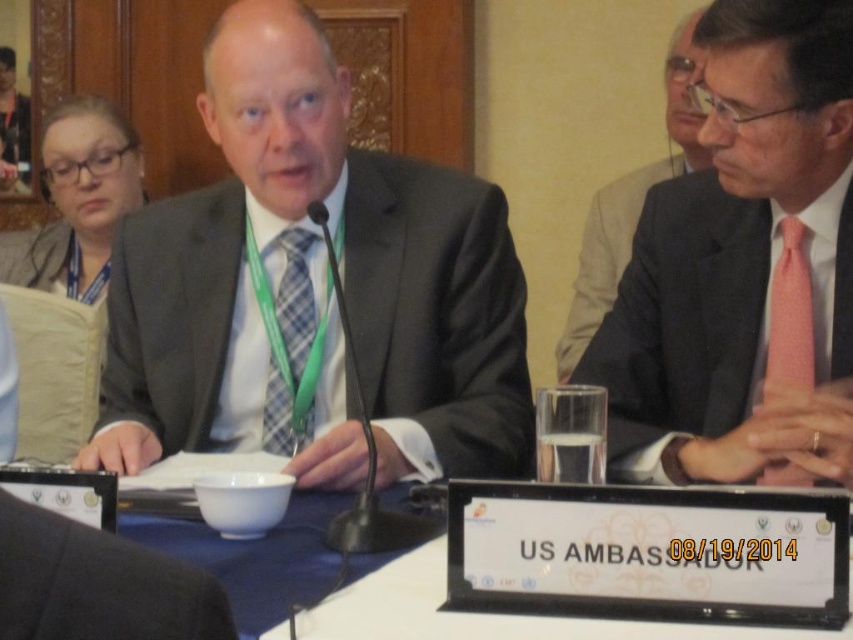
You are attending a formal event and need to identify the seating arrangement. Which object is positioned lower in the image, the black fabric business suit at lower left or the pink silk suit at right?

The black fabric business suit at lower left is located below the pink silk suit at right, so it is positioned lower in the image.

You are attending a formal event and need to determine the proper placement for a name tag. The name tag must be placed on an object that is taller than the other. Which object should you choose between the matte black suit at center and the pink dotted tie at right?

The matte black suit at center is taller than the pink dotted tie at right, so the name tag should be placed on the matte black suit at center.

Based on the photo, you are standing in the conference room and want to find the black fabric business suit at lower left. According to the coordinates provided, where should you look?

You should look at point (97, 582) to find the black fabric business suit at lower left.